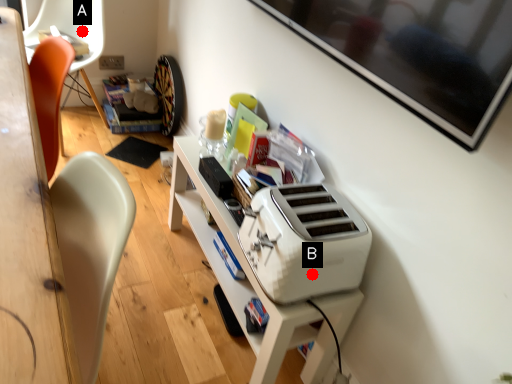
Question: Two points are circled on the image, labeled by A and B beside each circle. Which point is further to the camera?

Choices:
 (A) A is further
 (B) B is further

Answer: (A)